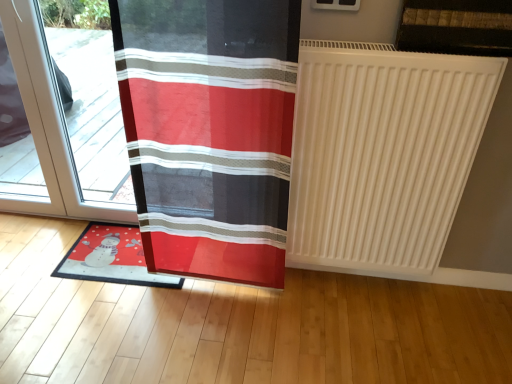
At what (x,y) coordinates should I click in order to perform the action: click on transparent glass door at left. Please return your answer as a coordinate pair (x, y). Looking at the image, I should click on (x=47, y=122).

Which is in front, point (270, 110) or point (298, 84)?

Positioned in front is point (298, 84).

Is red fabric curtain at left next to white matte radiator at right and touching it?

They are not placed beside each other.

From the image's perspective, which one is positioned higher, red fabric curtain at left or white matte radiator at right?

red fabric curtain at left, from the image's perspective.

Find the location of `mat lying below the red fabric curtain at left (from the image's perspective)`. mat lying below the red fabric curtain at left (from the image's perspective) is located at coordinates (111, 258).

Consider the image. Is matte plastic mat at lower left facing towards red fabric curtain at left?

No.

From a real-world perspective, does matte plastic mat at lower left stand above red fabric curtain at left?

No, from a real-world perspective, matte plastic mat at lower left is not on top of red fabric curtain at left.

Which of these two, matte plastic mat at lower left or red fabric curtain at left, stands taller?

red fabric curtain at left.

How many degrees apart are the facing directions of red fabric curtain at left and transparent glass door at left?

1.91 degrees separate the facing orientations of red fabric curtain at left and transparent glass door at left.

Is red fabric curtain at left not close to transparent glass door at left?

No.

Which object is positioned more to the left, red fabric curtain at left or transparent glass door at left?

transparent glass door at left.

Looking at this image, in terms of height, does white matte radiator at right look taller or shorter compared to matte plastic mat at lower left?

white matte radiator at right is taller than matte plastic mat at lower left.

Which object is more forward, white matte radiator at right or matte plastic mat at lower left?

white matte radiator at right is closer to the camera.

Which of these two, white matte radiator at right or matte plastic mat at lower left, is wider?

With larger width is matte plastic mat at lower left.

Which object is positioned more to the left, white matte radiator at right or matte plastic mat at lower left?

matte plastic mat at lower left is more to the left.

Consider the image. Considering the relative sizes of white matte radiator at right and transparent glass door at left in the image provided, is white matte radiator at right shorter than transparent glass door at left?

Yes, white matte radiator at right is shorter than transparent glass door at left.

Consider the image. Is white matte radiator at right facing away from transparent glass door at left?

No, transparent glass door at left is not at the back of white matte radiator at right.

Considering the positions of point (302, 111) and point (60, 135), is point (302, 111) closer or farther from the camera than point (60, 135)?

Point (302, 111) is positioned closer to the camera compared to point (60, 135).

From a real-world perspective, which object rests below the other?

transparent glass door at left, from a real-world perspective.

This screenshot has width=512, height=384. Find the location of `curtain on the right of matte plastic mat at lower left`. curtain on the right of matte plastic mat at lower left is located at coordinates (209, 131).

Is point (148, 118) in front of point (163, 277)?

Yes, point (148, 118) is closer to viewer.

Considering the relative positions of red fabric curtain at left and matte plastic mat at lower left in the image provided, is red fabric curtain at left to the left or to the right of matte plastic mat at lower left?

Clearly, red fabric curtain at left is on the right of matte plastic mat at lower left in the image.

Is red fabric curtain at left in front of or behind matte plastic mat at lower left in the image?

red fabric curtain at left is positioned closer to the viewer than matte plastic mat at lower left.

I want to click on curtain that appears above the transparent glass door at left (from a real-world perspective), so click(209, 131).

Can you confirm if transparent glass door at left is shorter than red fabric curtain at left?

Indeed, transparent glass door at left has a lesser height compared to red fabric curtain at left.

Considering their positions, is transparent glass door at left located in front of or behind red fabric curtain at left?

In the image, transparent glass door at left appears behind red fabric curtain at left.

From a real-world perspective, which object rests below the other?

transparent glass door at left is physically lower.

At what (x,y) coordinates should I click in order to perform the action: click on curtain that is in front of the white matte radiator at right. Please return your answer as a coordinate pair (x, y). This screenshot has height=384, width=512. Looking at the image, I should click on (209, 131).

This screenshot has height=384, width=512. In order to click on mat to the left of red fabric curtain at left in this screenshot , I will do 111,258.

Looking at the image, which one is located further to red fabric curtain at left, transparent glass door at left or white matte radiator at right?

transparent glass door at left is positioned further to the anchor red fabric curtain at left.

Considering their positions, is transparent glass door at left positioned closer to matte plastic mat at lower left than white matte radiator at right?

The object closer to matte plastic mat at lower left is transparent glass door at left.

Which object lies further to the anchor point transparent glass door at left, red fabric curtain at left or matte plastic mat at lower left?

Among the two, red fabric curtain at left is located further to transparent glass door at left.

Which object lies nearer to the anchor point red fabric curtain at left, white matte radiator at right or transparent glass door at left?

Among the two, white matte radiator at right is located nearer to red fabric curtain at left.

Estimate the real-world distances between objects in this image. Which object is further from transparent glass door at left, matte plastic mat at lower left or red fabric curtain at left?

red fabric curtain at left is positioned further to the anchor transparent glass door at left.

From the image, which object appears to be nearer to red fabric curtain at left, transparent glass door at left or matte plastic mat at lower left?

The object closer to red fabric curtain at left is matte plastic mat at lower left.

Estimate the real-world distances between objects in this image. Which object is further from red fabric curtain at left, matte plastic mat at lower left or transparent glass door at left?

Based on the image, transparent glass door at left appears to be further to red fabric curtain at left.

Considering their positions, is red fabric curtain at left positioned further to white matte radiator at right than matte plastic mat at lower left?

Based on the image, matte plastic mat at lower left appears to be further to white matte radiator at right.

At what (x,y) coordinates should I click in order to perform the action: click on mat situated between transparent glass door at left and white matte radiator at right from left to right. Please return your answer as a coordinate pair (x, y). Looking at the image, I should click on (111, 258).

Locate an element on the screen. Image resolution: width=512 pixels, height=384 pixels. curtain situated between matte plastic mat at lower left and white matte radiator at right from left to right is located at coordinates (209, 131).

This screenshot has width=512, height=384. In order to click on mat located between transparent glass door at left and red fabric curtain at left in the left-right direction in this screenshot , I will do `click(111, 258)`.

Find the location of a particular element. curtain between transparent glass door at left and white matte radiator at right in the horizontal direction is located at coordinates (209, 131).